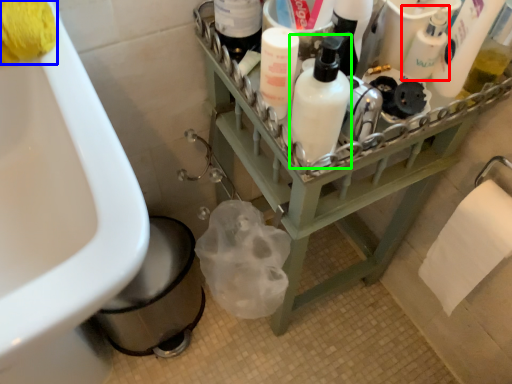
Question: Considering the real-world distances, which object is closest to cleaning product (highlighted by a red box)? toilet paper (highlighted by a blue box) or cleaning product (highlighted by a green box).

Choices:
 (A) toilet paper
 (B) cleaning product

Answer: (B)